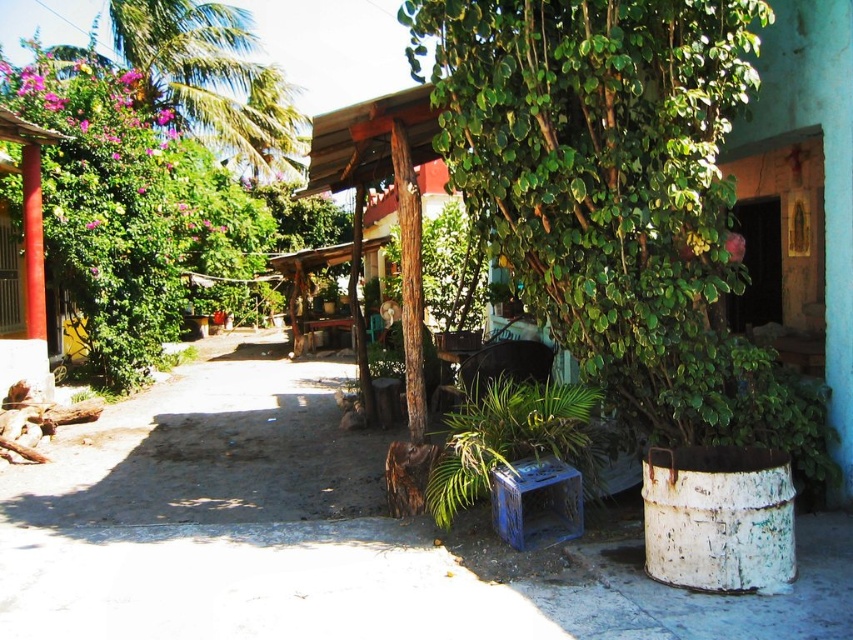
Which is below, rustic concrete alley at center or green leafy palm tree at upper left?

rustic concrete alley at center

Is rustic concrete alley at center above green leafy palm tree at upper left?

Incorrect, rustic concrete alley at center is not positioned above green leafy palm tree at upper left.

Identify the location of rustic concrete alley at center. This screenshot has height=640, width=853. (323, 536).

Where is `rustic concrete alley at center`? rustic concrete alley at center is located at coordinates (323, 536).

What do you see at coordinates (210, 77) in the screenshot?
I see `green leafy palm tree at upper left` at bounding box center [210, 77].

Can you confirm if green leafy palm tree at upper left is positioned above smooth red column at left?

Correct, green leafy palm tree at upper left is located above smooth red column at left.

The height and width of the screenshot is (640, 853). What do you see at coordinates (210, 77) in the screenshot?
I see `green leafy palm tree at upper left` at bounding box center [210, 77].

Locate an element on the screen. The width and height of the screenshot is (853, 640). green leafy palm tree at upper left is located at coordinates (210, 77).

Does point (602, 557) lie in front of point (33, 202)?

Yes, it is.

Based on the photo, between rustic concrete alley at center and smooth red column at left, which one appears on the right side from the viewer's perspective?

rustic concrete alley at center is more to the right.

What do you see at coordinates (323, 536) in the screenshot? The width and height of the screenshot is (853, 640). I see `rustic concrete alley at center` at bounding box center [323, 536].

You are a GUI agent. You are given a task and a screenshot of the screen. Output one action in this format:
    pyautogui.click(x=<x>, y=<y>)
    Task: Click on the rustic concrete alley at center
    Image resolution: width=853 pixels, height=640 pixels.
    Given the screenshot: What is the action you would take?
    pyautogui.click(x=323, y=536)